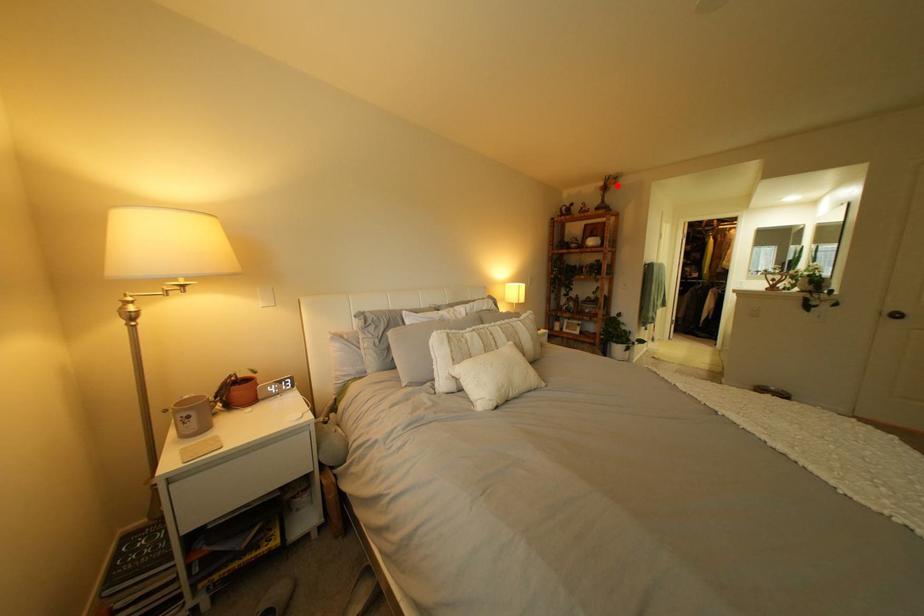
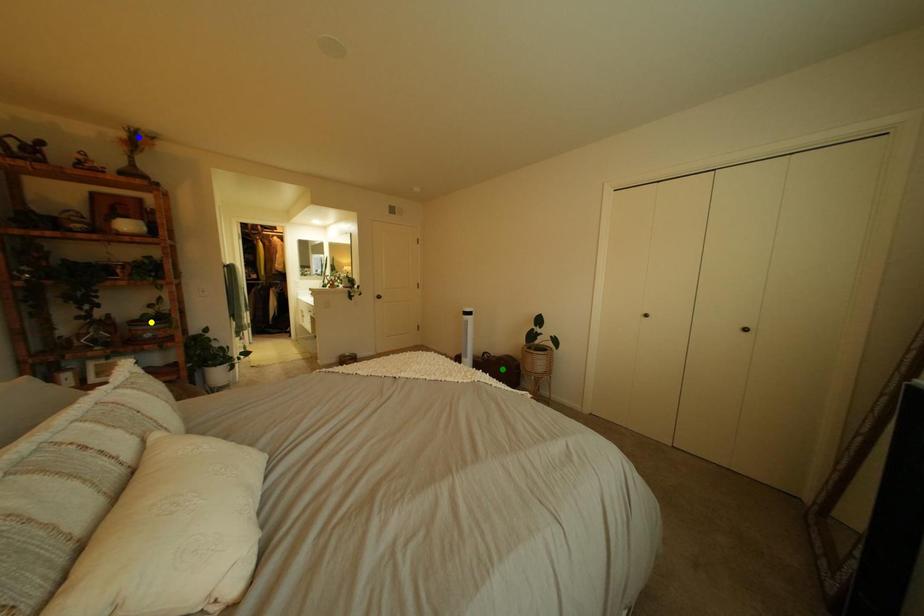
Question: I am providing you with two images of the same scene from different viewpoints. A red point is marked on the first image. You are given multiple points on the second image. Which point in image 2 represents the same 3d spot as the red point in image 1?

Choices:
 (A) green point
 (B) yellow point
 (C) blue point

Answer: (C)